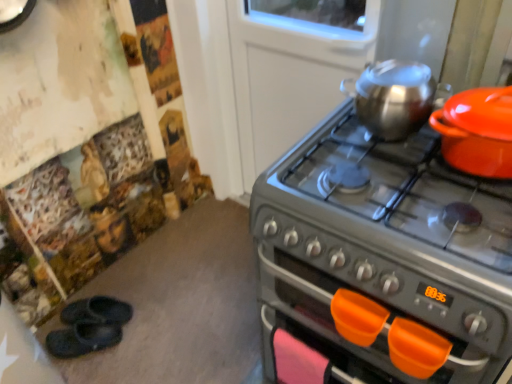
The width and height of the screenshot is (512, 384). Identify the location of free space in front of shiny metallic kettle at upper right, positioned as the second kitchen appliance in right-to-left order. (395, 172).